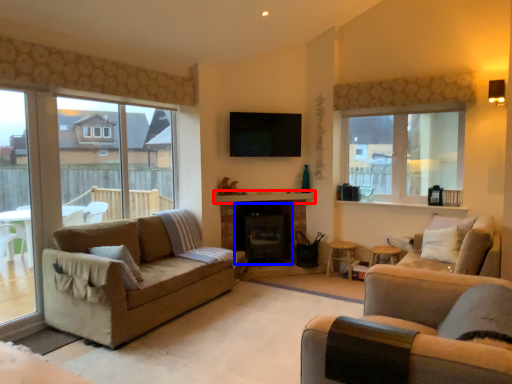
Question: Which point is further to the camera, mantle (highlighted by a red box) or fireplace (highlighted by a blue box)?

Choices:
 (A) mantle
 (B) fireplace

Answer: (B)